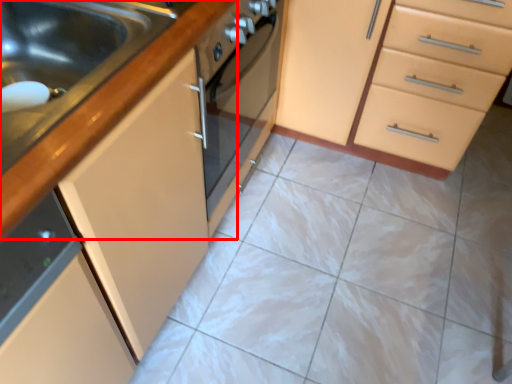
Question: From the image's perspective, where is countertop (annotated by the red box) located relative to cabinetry?

Choices:
 (A) above
 (B) below

Answer: (B)